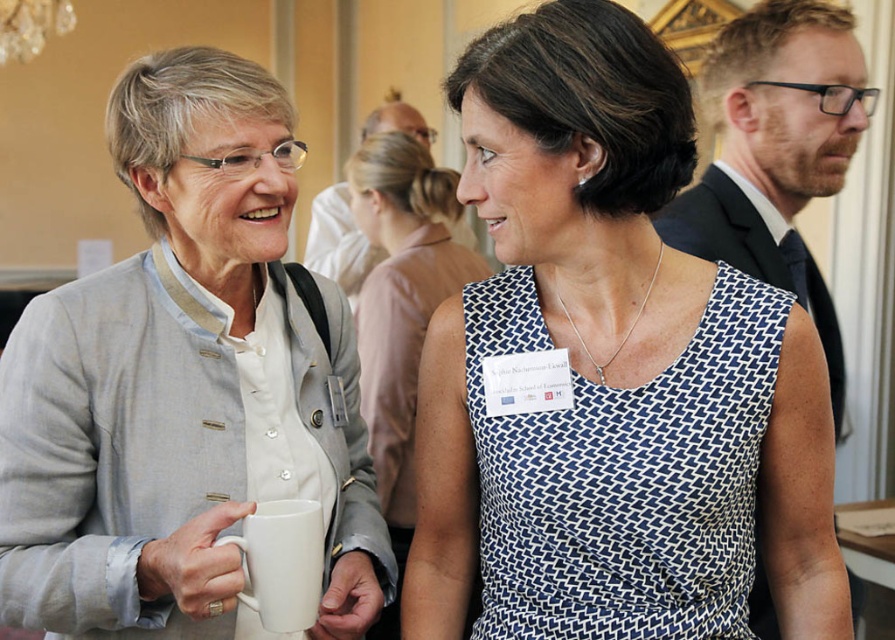
You are standing at the point with coordinates point (556, 160) and want to move towards point (257, 512). Which direction should you move to get closer to your destination?

You should move downward and to the right because point (556, 160) is further to the camera than point (257, 512), so moving in that direction will bring you closer.

You are a photographer at a conference. You want to take a photo of both the light gray fabric jacket at upper left and the white dotted dress at center. The minimum distance required for your camera to focus on both subjects clearly is 1.2 meters. Can you capture both in focus from your current position?

The distance between the light gray fabric jacket at upper left and the white dotted dress at center is 1.03 meters, which is less than the required 1.2 meters for the camera to focus both clearly. Therefore, you cannot capture both in focus from your current position.

Based on the scene description, which object is positioned higher in the image? The light gray fabric jacket at upper left or the white dotted dress at center?

The light gray fabric jacket at upper left is positioned higher in the image than the white dotted dress at center according to the description.